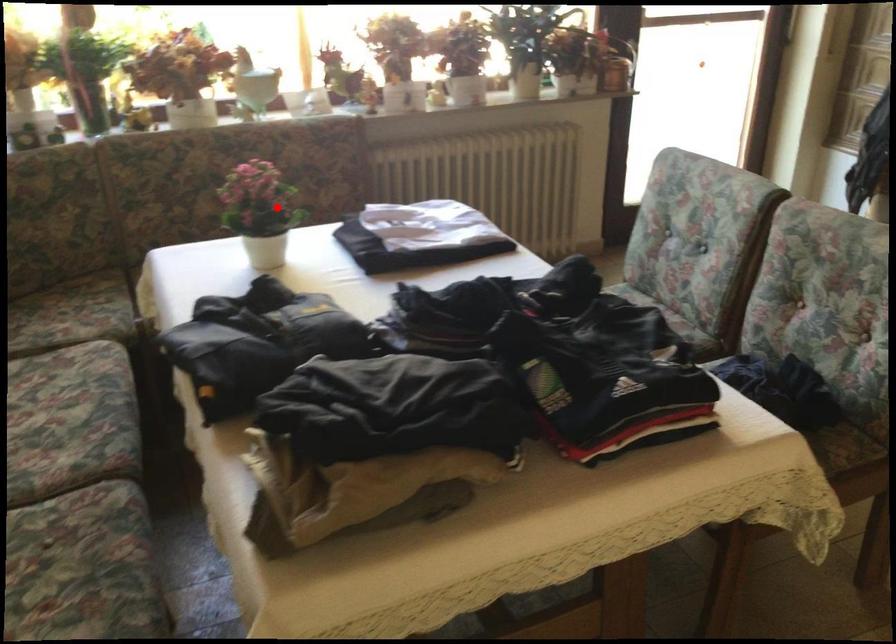
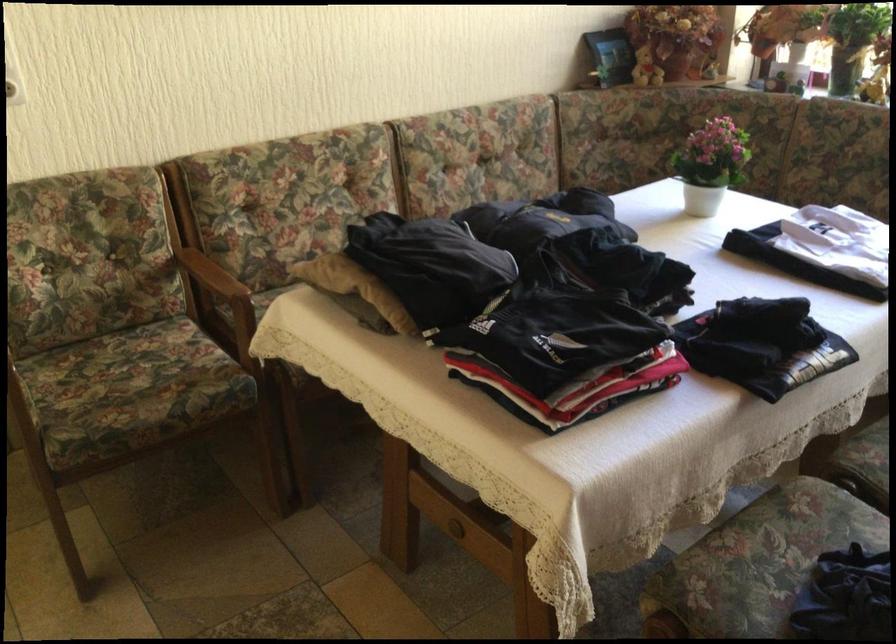
In the second image, find the point that corresponds to the highlighted location in the first image.

(711, 164)